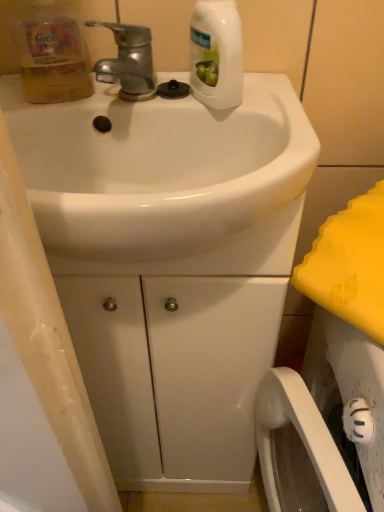
Question: Which direction should I rotate to look at white glossy bottle at upper center, which appears as the second cleaning product when viewed from the left?

Choices:
 (A) left
 (B) right

Answer: (B)

Question: Does white glossy bottle at upper center, marked as the first cleaning product in a right-to-left arrangement, lie in front of white glossy sink at center?

Choices:
 (A) yes
 (B) no

Answer: (B)

Question: From the image's perspective, does white glossy bottle at upper center, marked as the first cleaning product in a right-to-left arrangement, appear higher than white glossy sink at center?

Choices:
 (A) no
 (B) yes

Answer: (B)

Question: From a real-world perspective, is white glossy bottle at upper center, which appears as the second cleaning product when viewed from the left, below white glossy sink at center?

Choices:
 (A) yes
 (B) no

Answer: (B)

Question: Does white glossy bottle at upper center, marked as the first cleaning product in a right-to-left arrangement, have a smaller size compared to white glossy sink at center?

Choices:
 (A) yes
 (B) no

Answer: (A)

Question: Considering the relative sizes of white glossy bottle at upper center, marked as the first cleaning product in a right-to-left arrangement, and white glossy sink at center in the image provided, is white glossy bottle at upper center, marked as the first cleaning product in a right-to-left arrangement, wider than white glossy sink at center?

Choices:
 (A) yes
 (B) no

Answer: (B)

Question: Is white glossy bottle at upper center, which appears as the second cleaning product when viewed from the left, thinner than white glossy sink at center?

Choices:
 (A) yes
 (B) no

Answer: (A)

Question: Is translucent yellow bottle at upper left, the 1th cleaning product in the left-to-right sequence, shorter than shiny metallic faucet at upper left?

Choices:
 (A) no
 (B) yes

Answer: (A)

Question: Is the position of translucent yellow bottle at upper left, the 2th cleaning product viewed from the right, more distant than that of shiny metallic faucet at upper left?

Choices:
 (A) yes
 (B) no

Answer: (B)

Question: Does translucent yellow bottle at upper left, the 2th cleaning product viewed from the right, have a greater width compared to shiny metallic faucet at upper left?

Choices:
 (A) no
 (B) yes

Answer: (A)

Question: Could shiny metallic faucet at upper left be considered to be inside translucent yellow bottle at upper left, the 1th cleaning product in the left-to-right sequence?

Choices:
 (A) yes
 (B) no

Answer: (B)

Question: Is translucent yellow bottle at upper left, the 1th cleaning product in the left-to-right sequence, not close to shiny metallic faucet at upper left?

Choices:
 (A) no
 (B) yes

Answer: (A)

Question: Is translucent yellow bottle at upper left, the 1th cleaning product in the left-to-right sequence, completely or partially outside of shiny metallic faucet at upper left?

Choices:
 (A) yes
 (B) no

Answer: (A)

Question: From the image's perspective, would you say white glossy bottle at upper center, which appears as the second cleaning product when viewed from the left, is positioned over translucent yellow bottle at upper left, the 2th cleaning product viewed from the right?

Choices:
 (A) yes
 (B) no

Answer: (A)